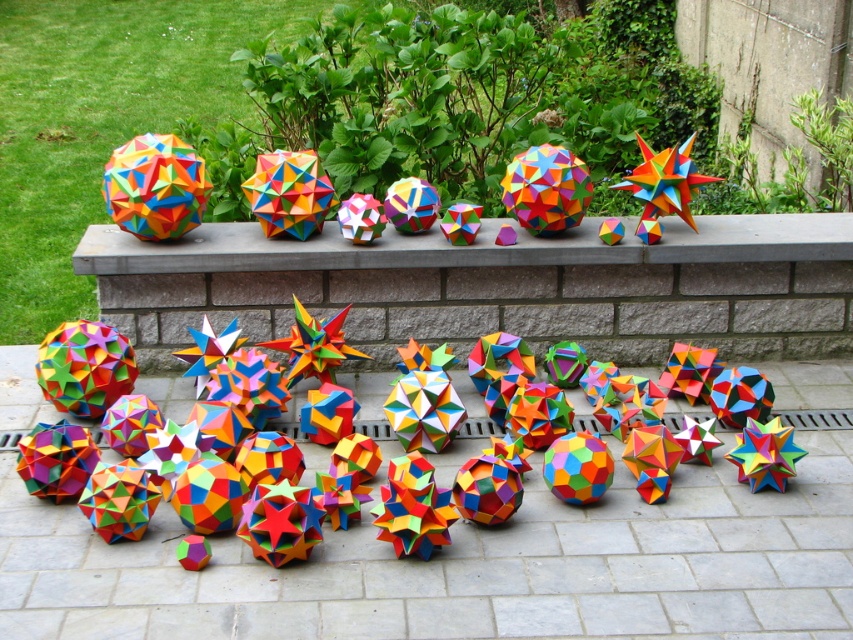
You are an artist trying to place a new sculpture between the matte colorful origami at upper center and the multicolored paper at center. Which object should you place the sculpture closer to if you want it to be near the wider one?

The multicolored paper at center is wider than the matte colorful origami at upper center, so you should place the sculpture closer to the multicolored paper at center.

You are an artist trying to place a new sculpture between the matte colorful origami at upper center and the multicolored paper at center. The sculpture is 3 inches wide. Do you think it will fit in the space between them?

The space between the matte colorful origami at upper center and the multicolored paper at center is 2.99 inches. Since the sculpture is 3 inches wide, it will not fit as it is slightly wider than the available space.